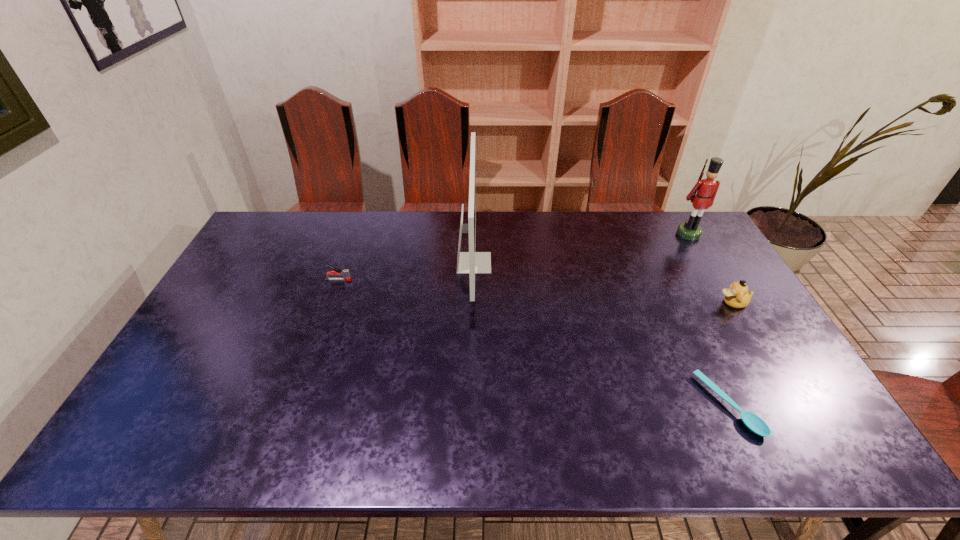
Locate an element on the screen. This screenshot has width=960, height=540. monitor is located at coordinates (471, 262).

This screenshot has height=540, width=960. What are the coordinates of `nutcracker` in the screenshot? It's located at (x=706, y=189).

The image size is (960, 540). Identify the location of the third tallest object. (737, 296).

Find the location of a particular element. This screenshot has width=960, height=540. stapler is located at coordinates (345, 273).

You are a GUI agent. You are given a task and a screenshot of the screen. Output one action in this format:
    pyautogui.click(x=<x>, y=<y>)
    Task: Click on the leftmost object
    Image resolution: width=960 pixels, height=540 pixels.
    Given the screenshot: What is the action you would take?
    pyautogui.click(x=345, y=273)

This screenshot has height=540, width=960. I want to click on the nearest object, so click(753, 422).

Find the location of a particular element. The width and height of the screenshot is (960, 540). spoon is located at coordinates (753, 422).

The image size is (960, 540). Identify the location of vacant space located 0.310m on the front-facing side of the second object from left to right. (583, 263).

I want to click on free space located 0.340m on the front-facing side of the nutcracker, so click(x=733, y=309).

At what (x,y) coordinates should I click in order to perform the action: click on free space located 0.350m on the face of the third tallest object. Please return your answer as a coordinate pair (x, y). The height and width of the screenshot is (540, 960). Looking at the image, I should click on (603, 303).